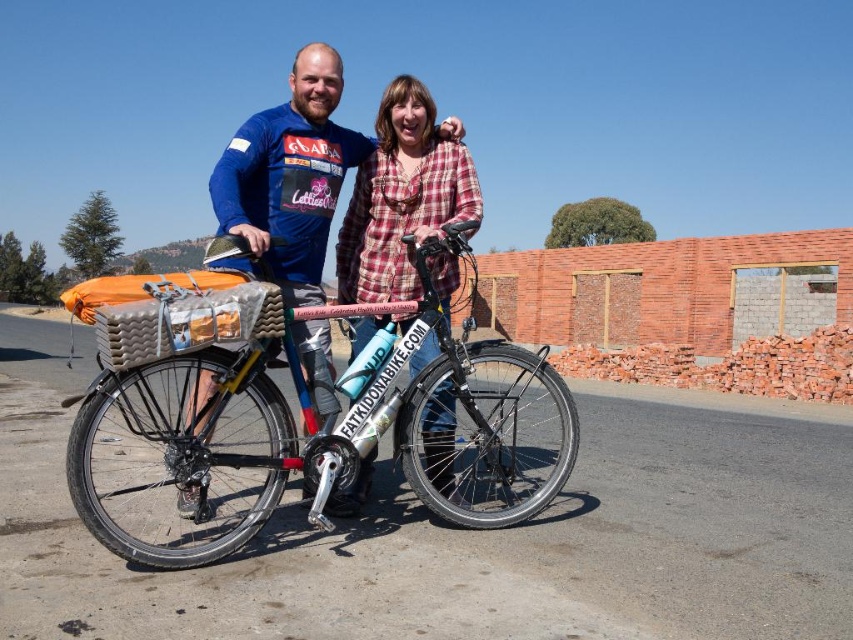
Question: Which of the following is the farthest from the observer?

Choices:
 (A) silver metallic bicycle at center
 (B) plaid fabric shirt at center

Answer: (A)

Question: Is silver metallic bicycle at center thinner than brushed metal bicycle at center?

Choices:
 (A) no
 (B) yes

Answer: (B)

Question: Estimate the real-world distances between objects in this image. Which object is farther from the plaid fabric shirt at center?

Choices:
 (A) silver metallic bicycle at center
 (B) brushed metal bicycle at center

Answer: (A)

Question: Which of these objects is positioned farthest from the plaid fabric shirt at center?

Choices:
 (A) silver metallic bicycle at center
 (B) brushed metal bicycle at center

Answer: (A)

Question: Can you confirm if brushed metal bicycle at center is positioned to the right of plaid fabric shirt at center?

Choices:
 (A) yes
 (B) no

Answer: (B)

Question: Can you confirm if brushed metal bicycle at center is thinner than plaid fabric shirt at center?

Choices:
 (A) no
 (B) yes

Answer: (A)